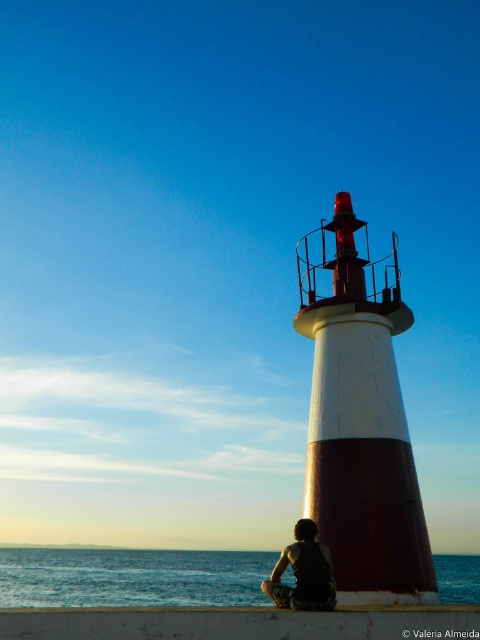
Is white concrete ledge at lower center closer to the viewer compared to dark hair at lower center?

That is True.

Which is in front, point (166, 628) or point (321, 573)?

Positioned in front is point (166, 628).

This screenshot has width=480, height=640. In order to click on white concrete ledge at lower center in this screenshot , I will do `click(241, 621)`.

Which is more to the left, blue water at lower left or white concrete ledge at lower center?

Positioned to the left is white concrete ledge at lower center.

Which is in front, point (153, 586) or point (424, 614)?

Positioned in front is point (424, 614).

Does point (228, 586) come behind point (3, 616)?

That is True.

Locate an element on the screen. blue water at lower left is located at coordinates (132, 577).

Is blue water at lower left smaller than dark hair at lower center?

Incorrect, blue water at lower left is not smaller in size than dark hair at lower center.

Which is more to the right, blue water at lower left or dark hair at lower center?

From the viewer's perspective, blue water at lower left appears more on the right side.

In order to click on blue water at lower left in this screenshot , I will do `click(132, 577)`.